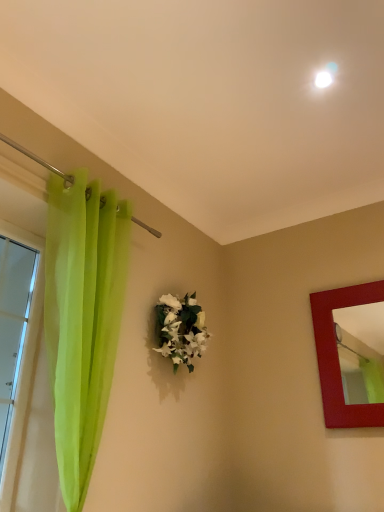
Question: Could transparent green curtain at left be considered to be inside white matte floral arrangement at center?

Choices:
 (A) yes
 (B) no

Answer: (B)

Question: From a real-world perspective, is white matte floral arrangement at center located higher than transparent green curtain at left?

Choices:
 (A) no
 (B) yes

Answer: (B)

Question: Considering the relative sizes of white matte floral arrangement at center and transparent green curtain at left in the image provided, is white matte floral arrangement at center wider than transparent green curtain at left?

Choices:
 (A) yes
 (B) no

Answer: (A)

Question: Is white matte floral arrangement at center far away from transparent green curtain at left?

Choices:
 (A) no
 (B) yes

Answer: (B)

Question: Can you confirm if white matte floral arrangement at center is smaller than transparent green curtain at left?

Choices:
 (A) yes
 (B) no

Answer: (A)

Question: Is white matte floral arrangement at center thinner than transparent green curtain at left?

Choices:
 (A) no
 (B) yes

Answer: (A)

Question: Is transparent green curtain at left to the right of white matte floral arrangement at center from the viewer's perspective?

Choices:
 (A) yes
 (B) no

Answer: (B)

Question: Is transparent green curtain at left further to camera compared to white matte floral arrangement at center?

Choices:
 (A) no
 (B) yes

Answer: (A)

Question: Considering the relative sizes of transparent green curtain at left and white matte floral arrangement at center in the image provided, is transparent green curtain at left thinner than white matte floral arrangement at center?

Choices:
 (A) no
 (B) yes

Answer: (B)

Question: Is transparent green curtain at left aimed at white matte floral arrangement at center?

Choices:
 (A) no
 (B) yes

Answer: (A)

Question: From the image's perspective, is transparent green curtain at left under white matte floral arrangement at center?

Choices:
 (A) no
 (B) yes

Answer: (B)

Question: Does transparent green curtain at left have a lesser height compared to white matte floral arrangement at center?

Choices:
 (A) no
 (B) yes

Answer: (A)

Question: Are white matte floral arrangement at center and matte red picture frame at right far apart?

Choices:
 (A) no
 (B) yes

Answer: (A)